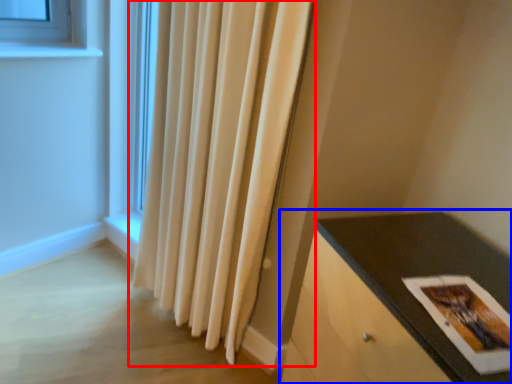
Question: Which object appears closest to the camera in this image, curtain (highlighted by a red box) or table (highlighted by a blue box)?

Choices:
 (A) curtain
 (B) table

Answer: (B)